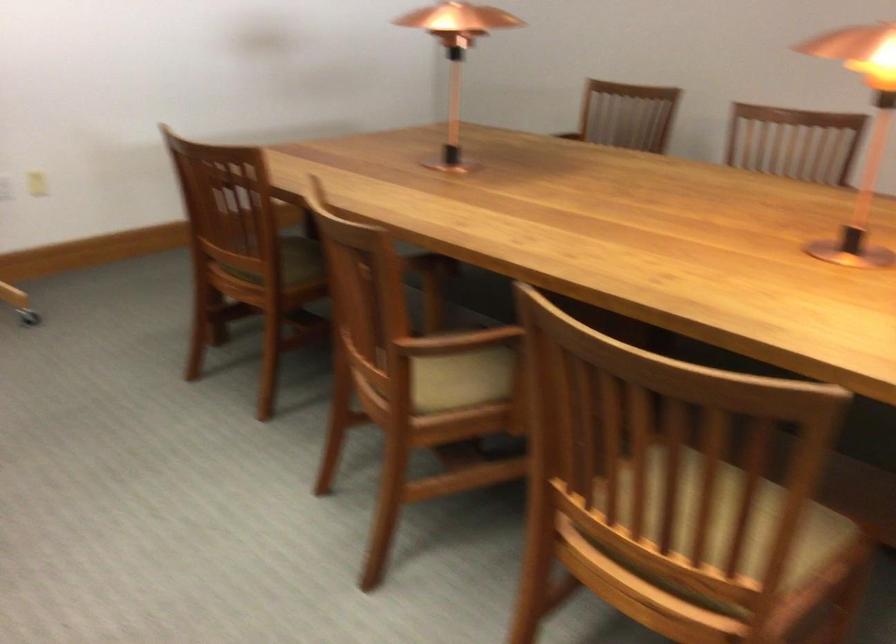
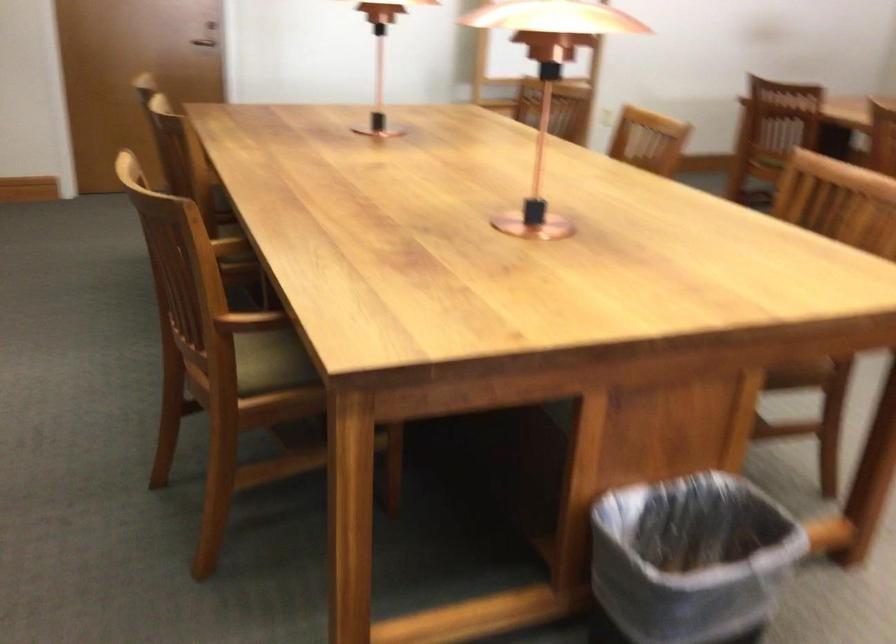
Question: I am providing you with two images of the same scene from different viewpoints. Which of the following objects are not visible in image2?

Choices:
 (A) wooden chair armrest
 (B) small white board
 (C) door handle
 (D) beige chair sitting surface

Answer: (D)